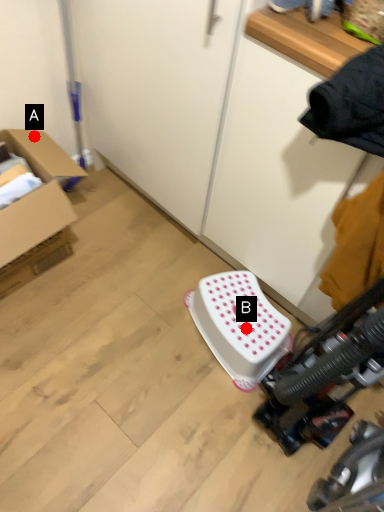
Question: Two points are circled on the image, labeled by A and B beside each circle. Which point is closer to the camera?

Choices:
 (A) A is closer
 (B) B is closer

Answer: (B)